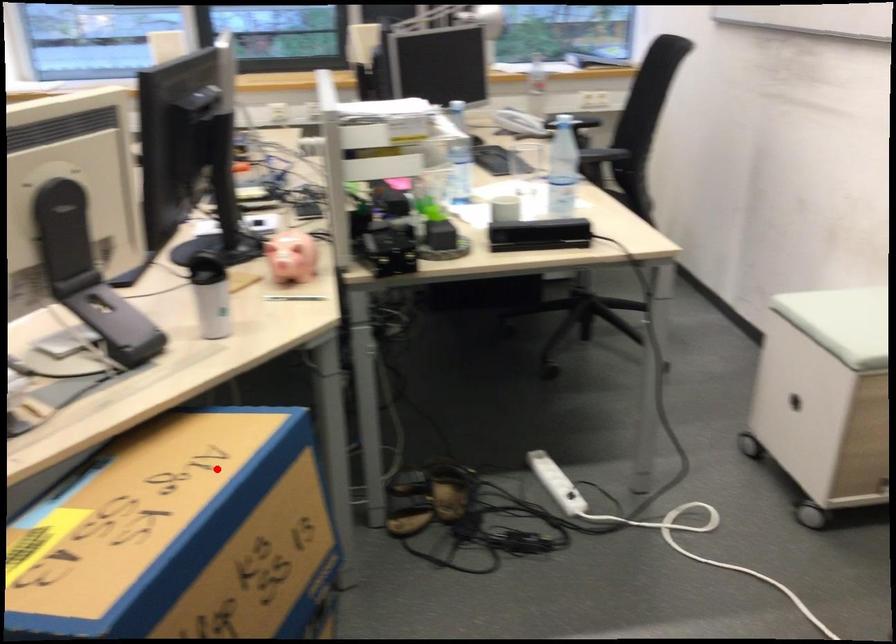
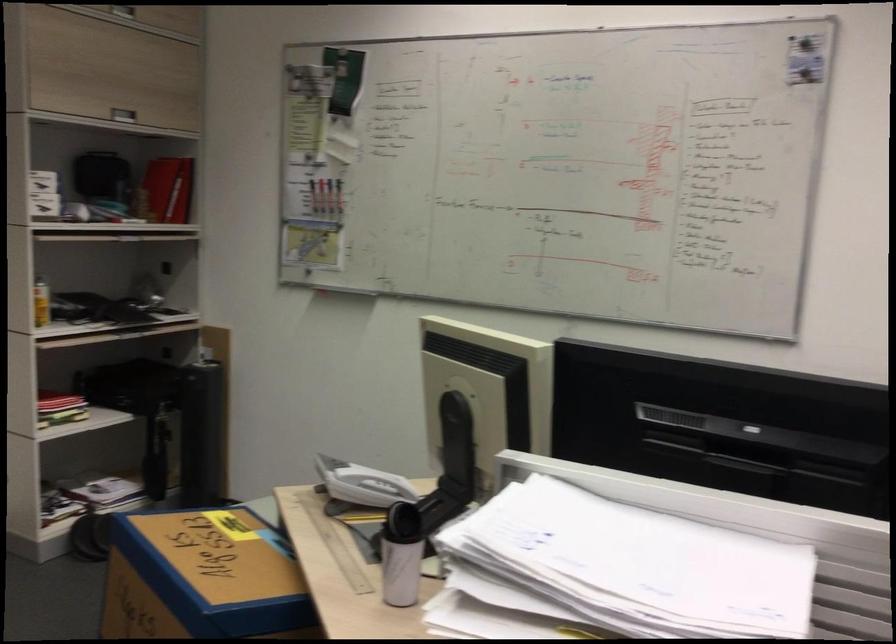
Locate, in the second image, the point that corresponds to the highlighted location in the first image.

(202, 578)